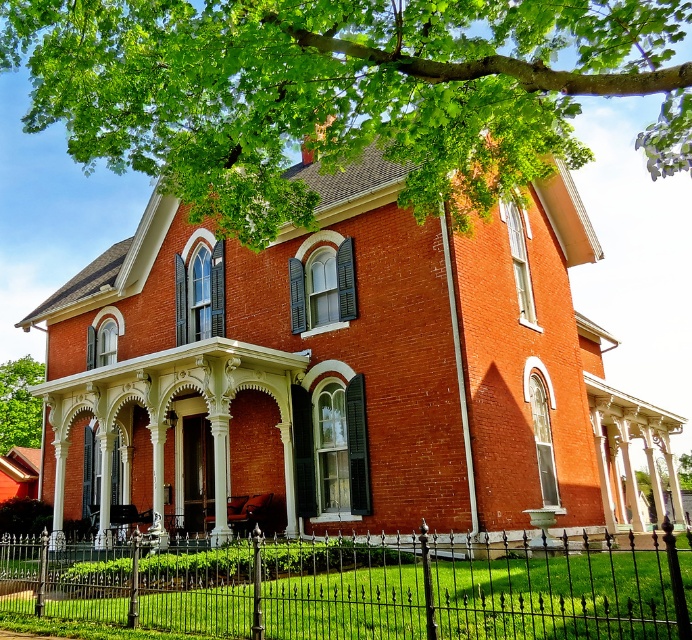
Can you confirm if green leafy tree at upper center is positioned below green leafy tree at center?

Incorrect, green leafy tree at upper center is not positioned below green leafy tree at center.

Who is higher up, green leafy tree at upper center or green leafy tree at center?

green leafy tree at upper center is higher up.

Find the location of a particular element. This screenshot has height=640, width=692. green leafy tree at upper center is located at coordinates (343, 92).

Where is `green leafy tree at upper center`? green leafy tree at upper center is located at coordinates (343, 92).

Which is more to the left, black wrought iron fence at lower center or green leafy tree at center?

From the viewer's perspective, green leafy tree at center appears more on the left side.

Is point (448, 628) closer to camera compared to point (0, 442)?

Yes, point (448, 628) is closer to viewer.

This screenshot has width=692, height=640. What are the coordinates of `black wrought iron fence at lower center` in the screenshot? It's located at (363, 586).

Does green leafy tree at upper center have a lesser width compared to black wrought iron fence at lower center?

Correct, green leafy tree at upper center's width is less than black wrought iron fence at lower center's.

Does point (579, 154) come behind point (203, 620)?

Yes.

Who is more distant from viewer, (69, 28) or (42, 548)?

The point (42, 548) is more distant.

This screenshot has width=692, height=640. Identify the location of green leafy tree at upper center. (343, 92).